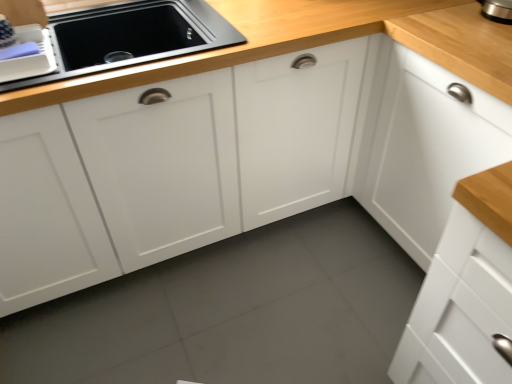
Question: Is white matte cabinet at upper right positioned before matte black sink at upper left?

Choices:
 (A) no
 (B) yes

Answer: (B)

Question: From the image's perspective, does white matte cabinet at upper right appear higher than matte black sink at upper left?

Choices:
 (A) yes
 (B) no

Answer: (B)

Question: From the image's perspective, is white matte cabinet at upper right located beneath matte black sink at upper left?

Choices:
 (A) yes
 (B) no

Answer: (A)

Question: Is white matte cabinet at upper right to the left of matte black sink at upper left from the viewer's perspective?

Choices:
 (A) yes
 (B) no

Answer: (B)

Question: Is white matte cabinet at upper right positioned with its back to matte black sink at upper left?

Choices:
 (A) yes
 (B) no

Answer: (B)

Question: Looking at the image, does matte plastic dish rack at upper left seem bigger or smaller compared to matte black sink at upper left?

Choices:
 (A) small
 (B) big

Answer: (A)

Question: From a real-world perspective, is matte plastic dish rack at upper left above or below matte black sink at upper left?

Choices:
 (A) below
 (B) above

Answer: (B)

Question: Considering the positions of matte plastic dish rack at upper left and matte black sink at upper left in the image, is matte plastic dish rack at upper left taller or shorter than matte black sink at upper left?

Choices:
 (A) short
 (B) tall

Answer: (A)

Question: Considering their positions, is matte plastic dish rack at upper left located in front of or behind matte black sink at upper left?

Choices:
 (A) behind
 (B) front

Answer: (B)

Question: From the image's perspective, is white matte cabinet at upper right above or below matte plastic dish rack at upper left?

Choices:
 (A) below
 (B) above

Answer: (A)

Question: From a real-world perspective, is white matte cabinet at upper right physically located above or below matte plastic dish rack at upper left?

Choices:
 (A) above
 (B) below

Answer: (B)

Question: Is white matte cabinet at upper right to the left or to the right of matte plastic dish rack at upper left in the image?

Choices:
 (A) left
 (B) right

Answer: (B)

Question: Is point (422, 210) closer or farther from the camera than point (9, 59)?

Choices:
 (A) farther
 (B) closer

Answer: (A)

Question: Considering their positions, is matte plastic dish rack at upper left located in front of or behind white matte cabinet at upper right?

Choices:
 (A) behind
 (B) front

Answer: (A)

Question: Is point (34, 56) closer or farther from the camera than point (382, 177)?

Choices:
 (A) farther
 (B) closer

Answer: (B)